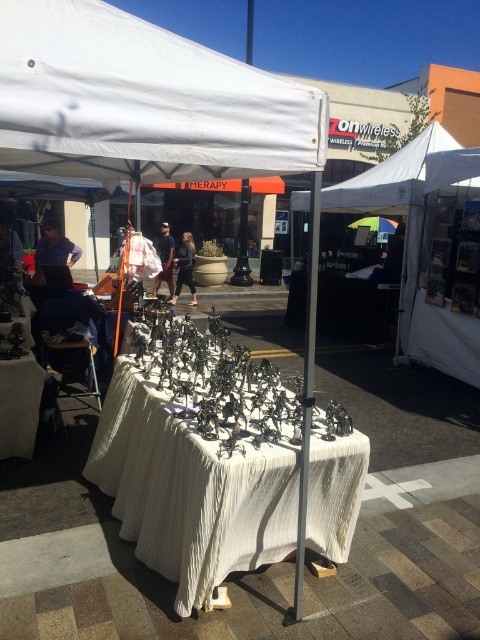
You are a customer at the market looking at the metallic silver figurines at center. Can you see the white fabric tent at upper center behind them?

Yes, because the metallic silver figurines at center are in front of the white fabric tent at upper center, so the tent is visible behind them.

You are standing at the camera position and want to take a photo of the white fabric tent at upper center. If your camera has a maximum focus range of 6 meters, will you be able to focus on the tent?

The white fabric tent at upper center and camera are 6.43 meters apart. Since the distance exceeds the camera maximum focus range of 6 meters, you won

From the picture: You are standing in front of the market table and want to take a photo. There are two points marked on the table surface at coordinates point (x=153, y=385) and point (x=435, y=134). Which point is closer to your camera lens when taking the photo?

Point (x=153, y=385) is closer to the camera than point (x=435, y=134), so it will appear nearer in the photo.